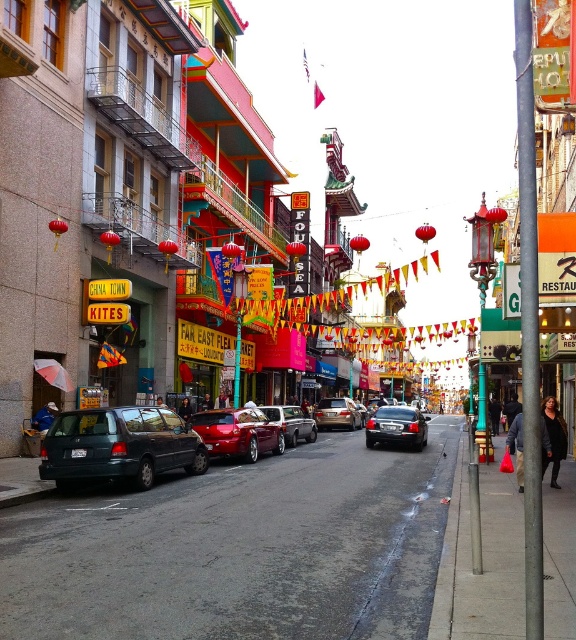
Question: Which of the following is the closest to the observer?

Choices:
 (A) glossy red car at center
 (B) shiny black sedan at center
 (C) shiny red car at center

Answer: (A)

Question: Which object is closer to the camera taking this photo?

Choices:
 (A) shiny silver sedan at center
 (B) shiny black sedan at center

Answer: (B)

Question: Among these points, which one is farthest from the camera?

Choices:
 (A) (172, 452)
 (B) (164, 529)
 (C) (395, 438)
 (D) (308, 429)

Answer: (D)

Question: Can you confirm if teal matte station wagon at lower left is positioned to the right of shiny black sedan at center?

Choices:
 (A) yes
 (B) no

Answer: (B)

Question: Is teal matte station wagon at lower left in front of shiny red car at center?

Choices:
 (A) no
 (B) yes

Answer: (B)

Question: Is shiny red car at center closer to camera compared to shiny silver sedan at center?

Choices:
 (A) no
 (B) yes

Answer: (B)